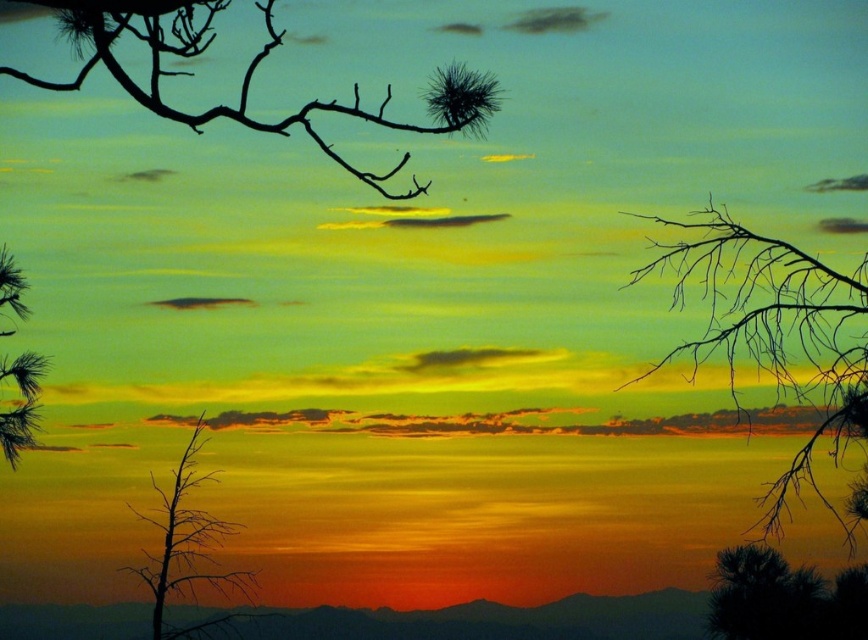
Question: Is silhouette branch at upper right below black matte branch at upper left?

Choices:
 (A) yes
 (B) no

Answer: (A)

Question: Which object is the farthest from the silhouette branch at upper right?

Choices:
 (A) silvery pine branch at left
 (B) silhouette bare tree at lower left

Answer: (A)

Question: Which point is closer to the camera taking this photo?

Choices:
 (A) (194, 54)
 (B) (763, 577)

Answer: (A)

Question: Is silhouette branch at upper right to the right of black matte branch at upper left from the viewer's perspective?

Choices:
 (A) yes
 (B) no

Answer: (A)

Question: Can you confirm if black matte branch at upper left is positioned above silhouette pine tree at lower right?

Choices:
 (A) no
 (B) yes

Answer: (B)

Question: Among these objects, which one is nearest to the camera?

Choices:
 (A) silhouette bare tree at lower left
 (B) black matte branch at upper left

Answer: (B)